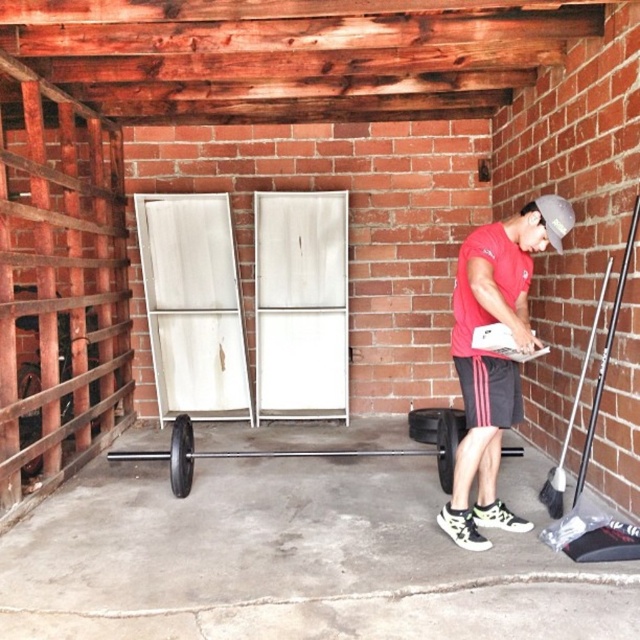
Does red matte shirt at center have a greater width compared to black rubber wheel at lower center?

Correct, the width of red matte shirt at center exceeds that of black rubber wheel at lower center.

Who is taller, red matte shirt at center or black rubber wheel at lower center?

With more height is red matte shirt at center.

Is point (467, 520) closer to camera compared to point (436, 465)?

Yes, it is.

This screenshot has width=640, height=640. Identify the location of red matte shirt at center. (493, 356).

Is point (170, 435) positioned after point (20, 369)?

Yes, it is behind point (20, 369).

This screenshot has width=640, height=640. In order to click on black rubber wheel at lower left in this screenshot , I will do `click(180, 456)`.

Locate an element on the screen. This screenshot has width=640, height=640. black rubber wheel at lower left is located at coordinates (180, 456).

The width and height of the screenshot is (640, 640). Find the location of `black rubber wheel at lower left`. black rubber wheel at lower left is located at coordinates (180, 456).

Can you confirm if red matte shirt at center is positioned to the left of black rubber wheel at left?

Incorrect, red matte shirt at center is not on the left side of black rubber wheel at left.

Does red matte shirt at center have a lesser width compared to black rubber wheel at left?

Incorrect, red matte shirt at center's width is not less than black rubber wheel at left's.

This screenshot has width=640, height=640. Identify the location of red matte shirt at center. (493, 356).

I want to click on red matte shirt at center, so click(493, 356).